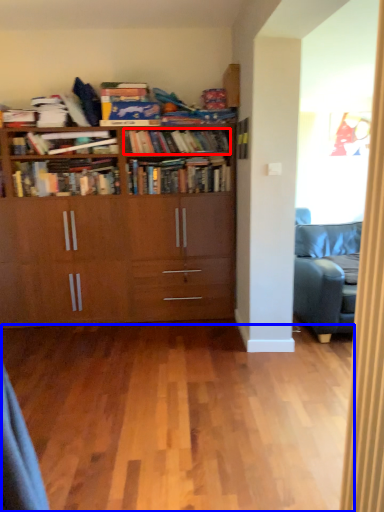
Question: Among these objects, which one is farthest to the camera, book (highlighted by a red box) or plain (highlighted by a blue box)?

Choices:
 (A) book
 (B) plain

Answer: (A)